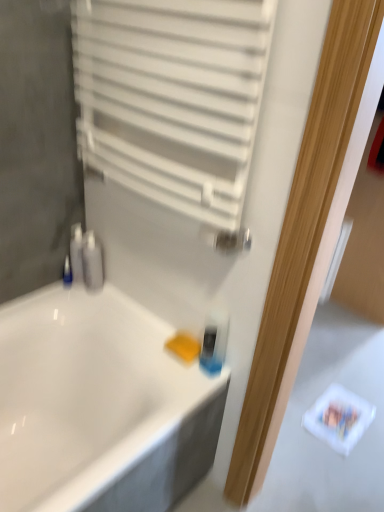
Where is `free space in front of yellow sponge at lower center`? Image resolution: width=384 pixels, height=512 pixels. free space in front of yellow sponge at lower center is located at coordinates (177, 385).